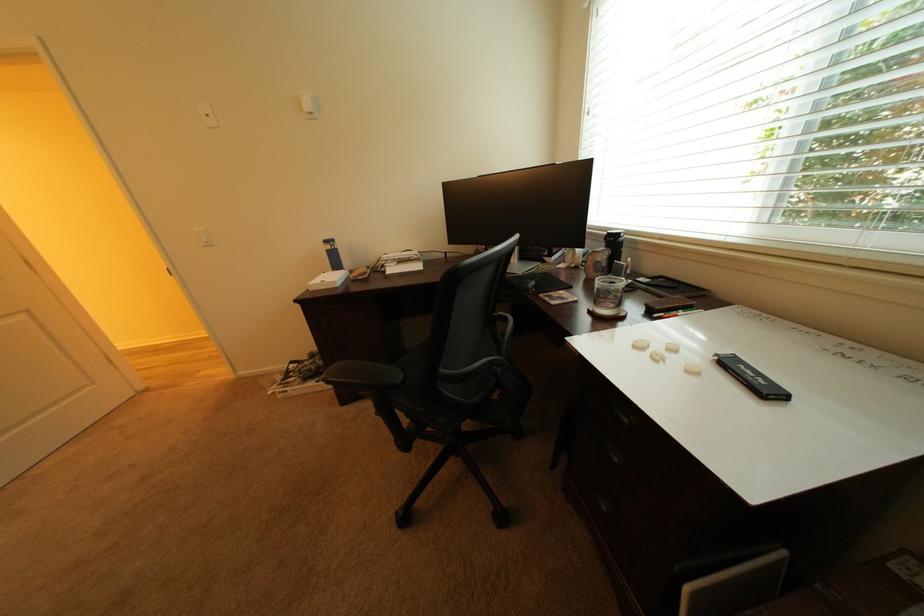
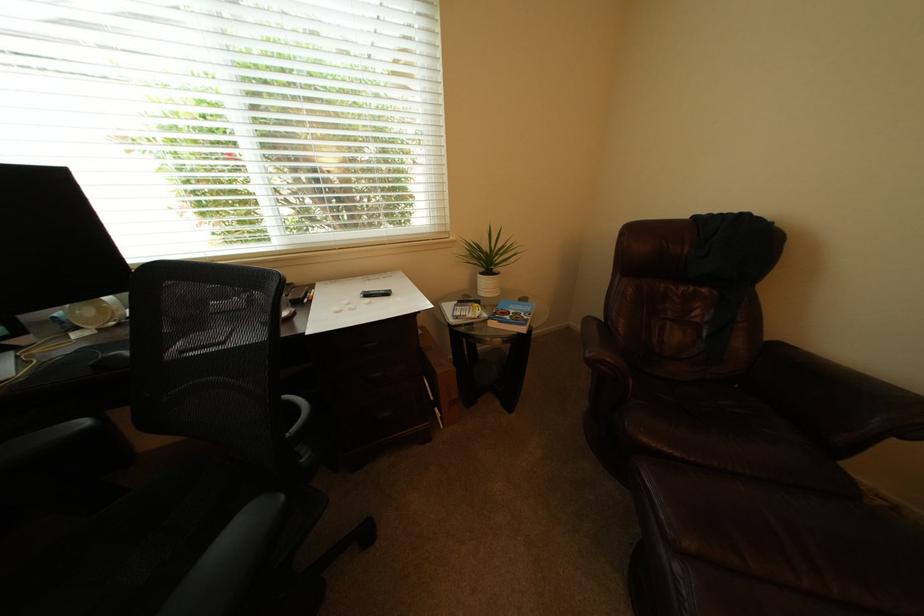
Where in the second image is the point corresponding to [738,365] from the first image?

(378, 297)